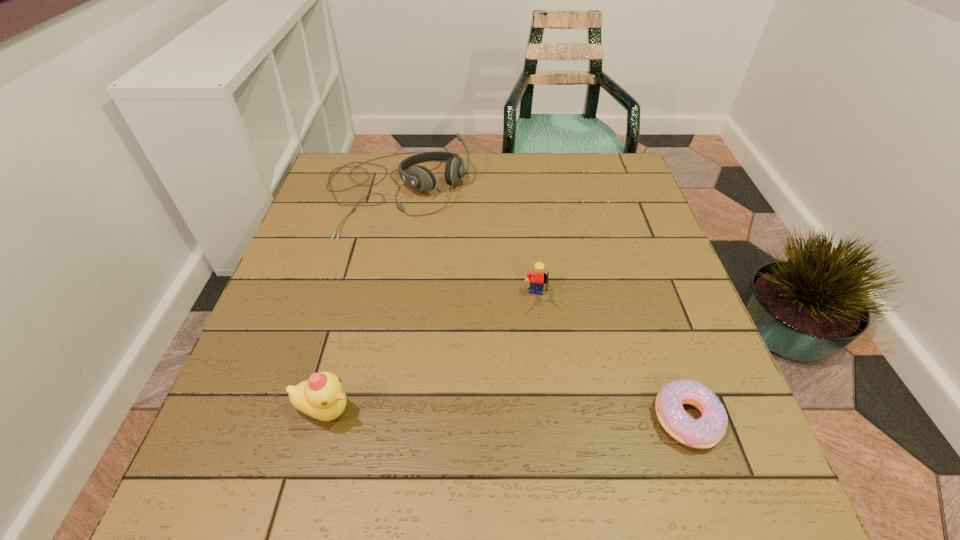
At what (x,y) coordinates should I click in order to perform the action: click on object positioned at the far left corner. Please return your answer as a coordinate pair (x, y). The width and height of the screenshot is (960, 540). Looking at the image, I should click on (420, 178).

The width and height of the screenshot is (960, 540). Identify the location of object that is positioned at the near left corner. (321, 396).

You are a GUI agent. You are given a task and a screenshot of the screen. Output one action in this format:
    pyautogui.click(x=<x>, y=<y>)
    Task: Click on the object that is at the near right corner
    The height and width of the screenshot is (540, 960).
    Given the screenshot: What is the action you would take?
    pyautogui.click(x=705, y=432)

I want to click on free region at the near edge, so click(x=373, y=399).

Locate an element on the screen. The image size is (960, 540). vacant region at the left edge of the desktop is located at coordinates (240, 393).

Identify the location of free space at the right edge of the desktop. This screenshot has height=540, width=960. (659, 279).

Find the location of a particular element. blank space at the far left corner of the desktop is located at coordinates (351, 173).

You are a GUI agent. You are given a task and a screenshot of the screen. Output one action in this format:
    pyautogui.click(x=<x>, y=<y>)
    Task: Click on the vacant space at the near right corner of the desktop
    The height and width of the screenshot is (540, 960).
    Given the screenshot: What is the action you would take?
    pyautogui.click(x=723, y=395)

The image size is (960, 540). Identify the location of vacant point located between the Lego and the shortest object. (612, 359).

Identify the location of free space between the Lego and the doughnut. This screenshot has height=540, width=960. (612, 359).